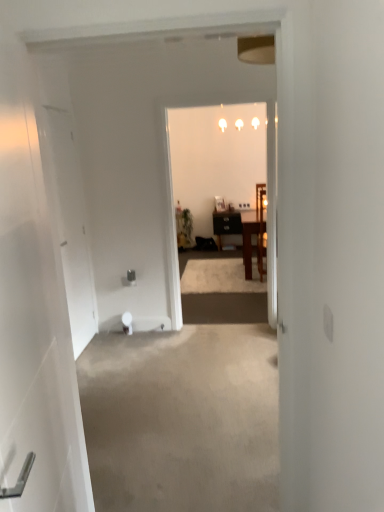
Question: From their relative heights in the image, would you say wooden chair at center, the 2th chair viewed from the front, is taller or shorter than green matte houseplant at center?

Choices:
 (A) short
 (B) tall

Answer: (B)

Question: From a real-world perspective, relative to green matte houseplant at center, is wooden chair at center, the 2th chair viewed from the front, vertically above or below?

Choices:
 (A) below
 (B) above

Answer: (A)

Question: Estimate the real-world distances between objects in this image. Which object is farther from the white glossy door at left, the first door viewed from the right?

Choices:
 (A) white glossy light fixture at upper center
 (B) wooden chair at center, the first chair from the front
 (C) green matte houseplant at center
 (D) white matte door at left, the second door in the right-to-left sequence
 (E) wooden chair at center, the 2th chair viewed from the front

Answer: (A)

Question: Which object is positioned farthest from the wooden chair at center, which is the first chair in back-to-front order?

Choices:
 (A) green matte houseplant at center
 (B) white glossy light fixture at upper center
 (C) wooden chair at center, the first chair from the front
 (D) white matte door at left, placed as the first door when sorted from back to front
 (E) white glossy door at left, positioned as the second door in back-to-front order

Answer: (E)